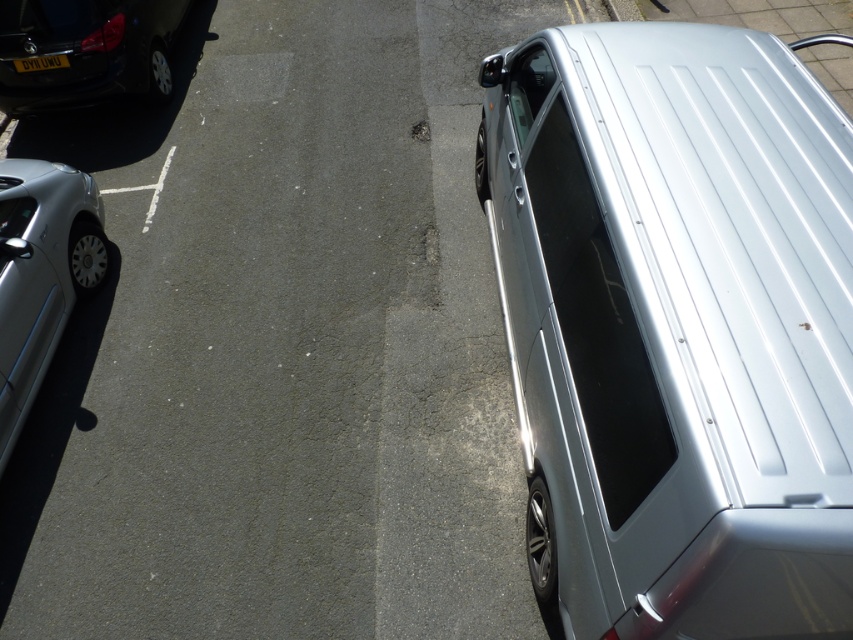
Can you confirm if metallic silver van at center is positioned to the right of silver metallic hatchback at left?

Yes, metallic silver van at center is to the right of silver metallic hatchback at left.

Based on the photo, does metallic silver van at center come in front of silver metallic hatchback at left?

Yes.

The image size is (853, 640). What do you see at coordinates (283, 348) in the screenshot?
I see `metallic silver van at center` at bounding box center [283, 348].

Identify the location of metallic silver van at center. (283, 348).

Can you confirm if shiny black car at upper left is smaller than black plastic license plate at upper left?

Incorrect, shiny black car at upper left is not smaller in size than black plastic license plate at upper left.

Is shiny black car at upper left closer to the viewer compared to black plastic license plate at upper left?

Yes, shiny black car at upper left is in front of black plastic license plate at upper left.

Is point (151, 67) positioned behind point (48, 58)?

Yes, it is behind point (48, 58).

The image size is (853, 640). What are the coordinates of `shiny black car at upper left` in the screenshot? It's located at (84, 51).

Can you confirm if silver metallic hatchback at left is positioned to the right of black plastic license plate at upper left?

Yes, silver metallic hatchback at left is to the right of black plastic license plate at upper left.

Based on the photo, does silver metallic hatchback at left have a lesser height compared to black plastic license plate at upper left?

Incorrect, silver metallic hatchback at left's height does not fall short of black plastic license plate at upper left's.

Find the location of `silver metallic hatchback at left`. silver metallic hatchback at left is located at coordinates (41, 275).